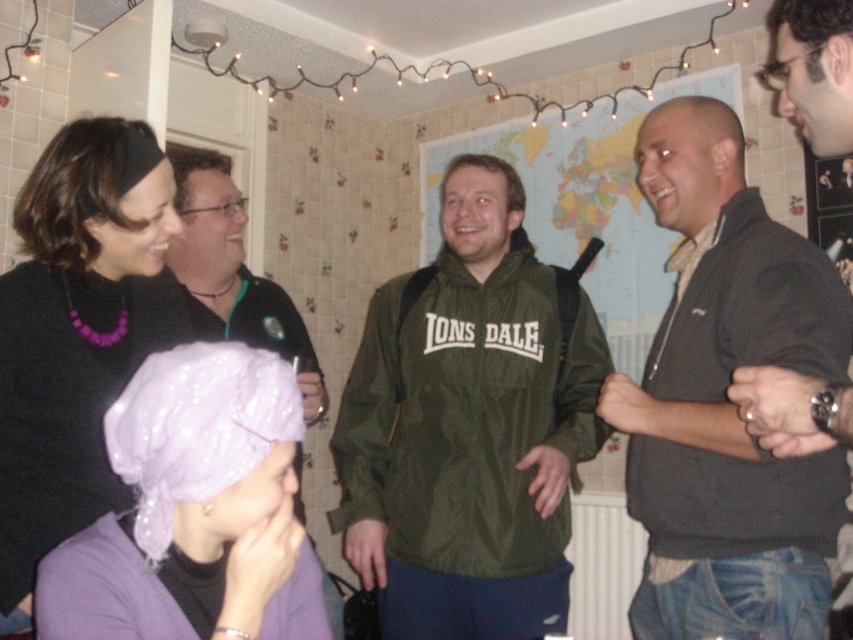
Question: Where is olive green nylon jacket at center located in relation to dark gray sweater at center in the image?

Choices:
 (A) above
 (B) below

Answer: (B)

Question: From the image, what is the correct spatial relationship of dark gray sweater at center in relation to black matte sweater at upper left?

Choices:
 (A) left
 (B) right

Answer: (B)

Question: Can you confirm if olive green nylon jacket at center is wider than dark gray sweater at center?

Choices:
 (A) yes
 (B) no

Answer: (A)

Question: Considering the real-world distances, which object is closest to the black matte jacket at upper left?

Choices:
 (A) olive green nylon jacket at center
 (B) dark gray sweater at center
 (C) purple sequined headscarf at lower left

Answer: (A)

Question: Which point appears farthest from the camera in this image?

Choices:
 (A) (35, 355)
 (B) (299, 321)
 (C) (218, 509)
 (D) (688, 433)

Answer: (B)

Question: Which point is farther to the camera?

Choices:
 (A) (421, 282)
 (B) (258, 509)
 (C) (207, 305)
 (D) (62, 321)

Answer: (C)